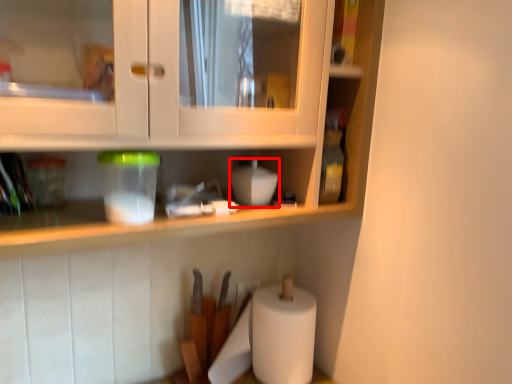
Question: From the image's perspective, what is the correct spatial relationship of appliance (annotated by the red box) in relation to appliance?

Choices:
 (A) below
 (B) above

Answer: (B)